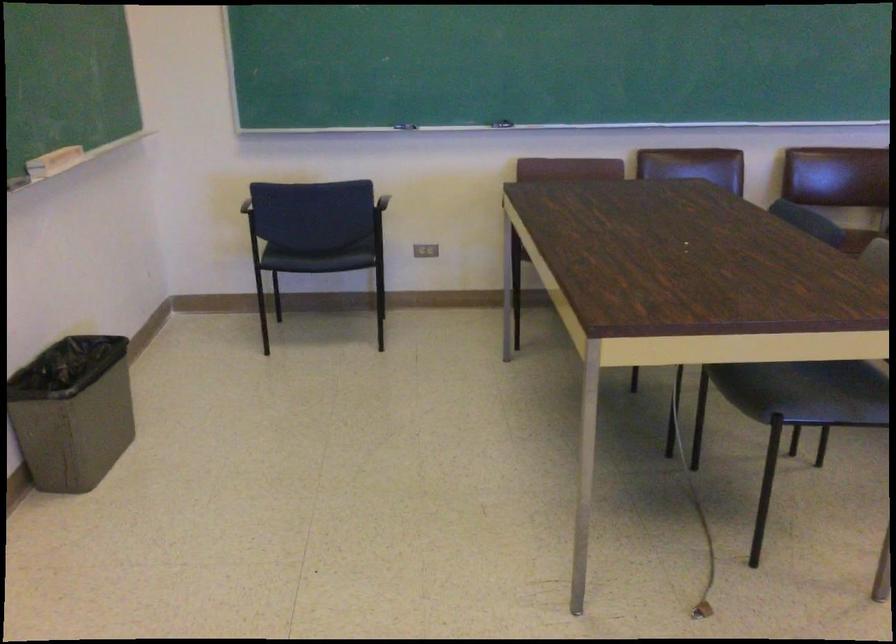
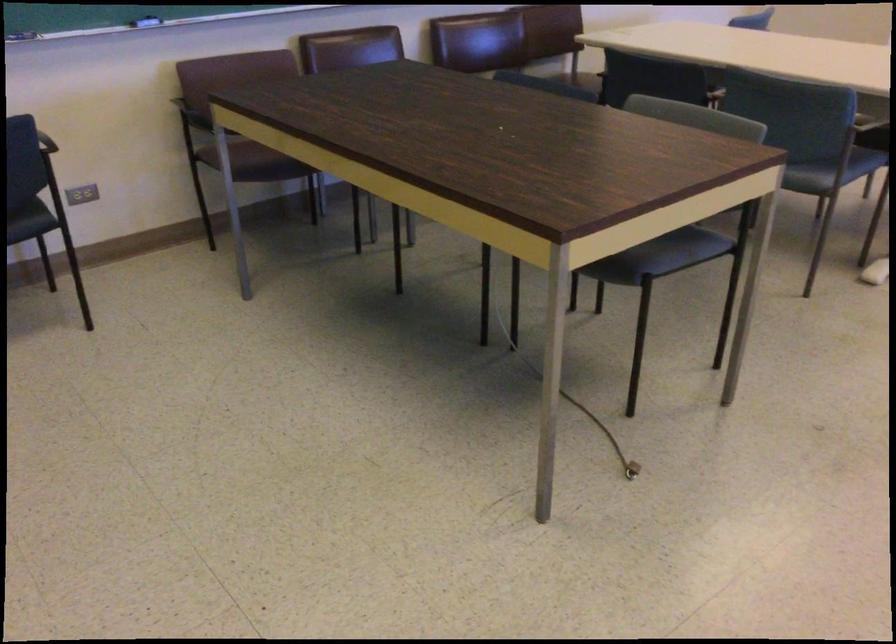
Question: The camera is either moving clockwise (left) or counter-clockwise (right) around the object. The first image is from the beginning of the video and the second image is from the end. Is the camera moving left or right when shooting the video?

Choices:
 (A) Left
 (B) Right

Answer: (A)